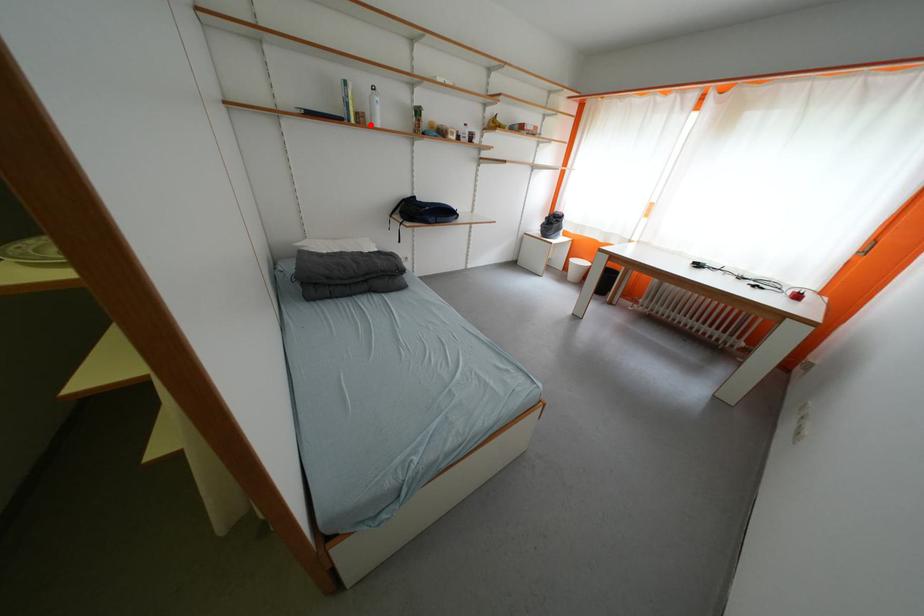
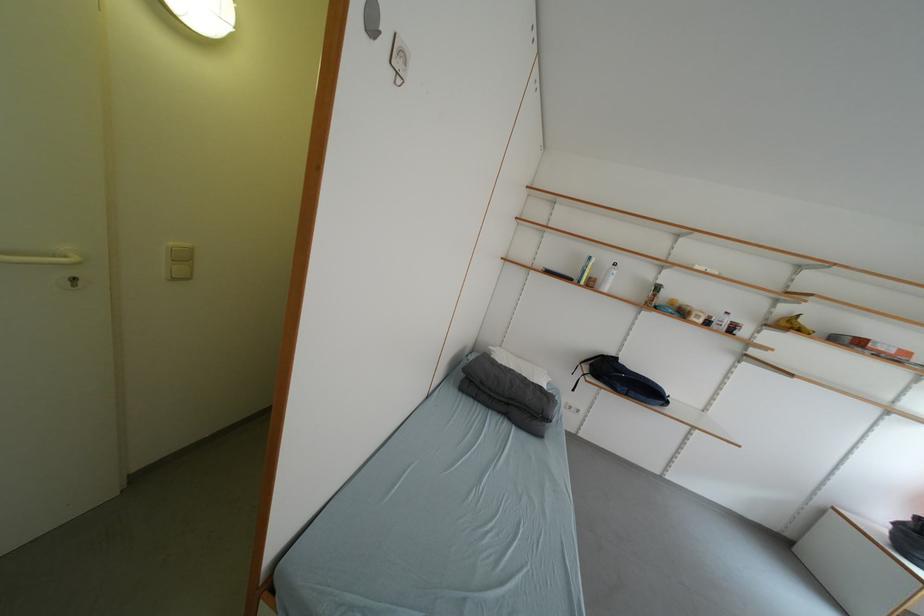
Find the pixel in the second image that matches the highlighted location in the first image.

(600, 286)